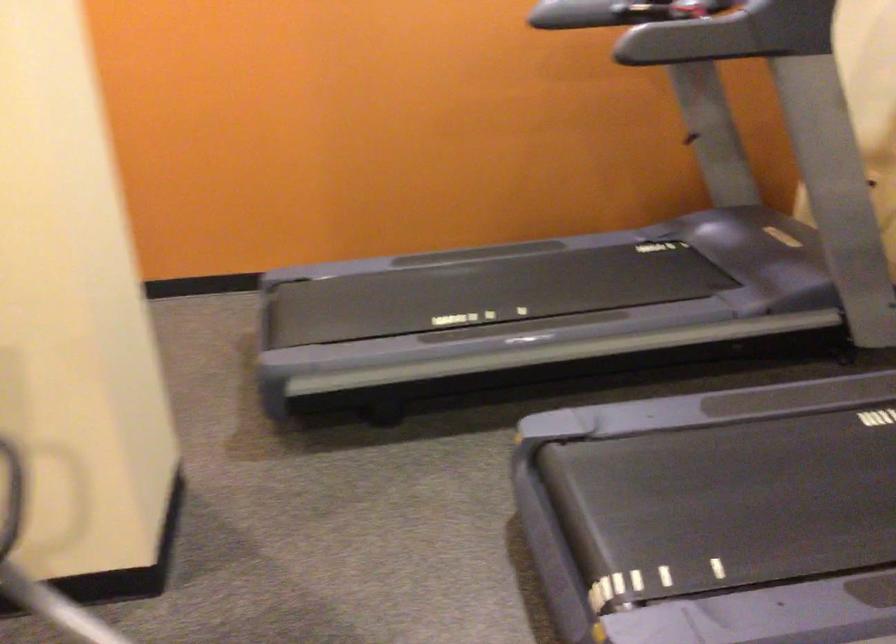
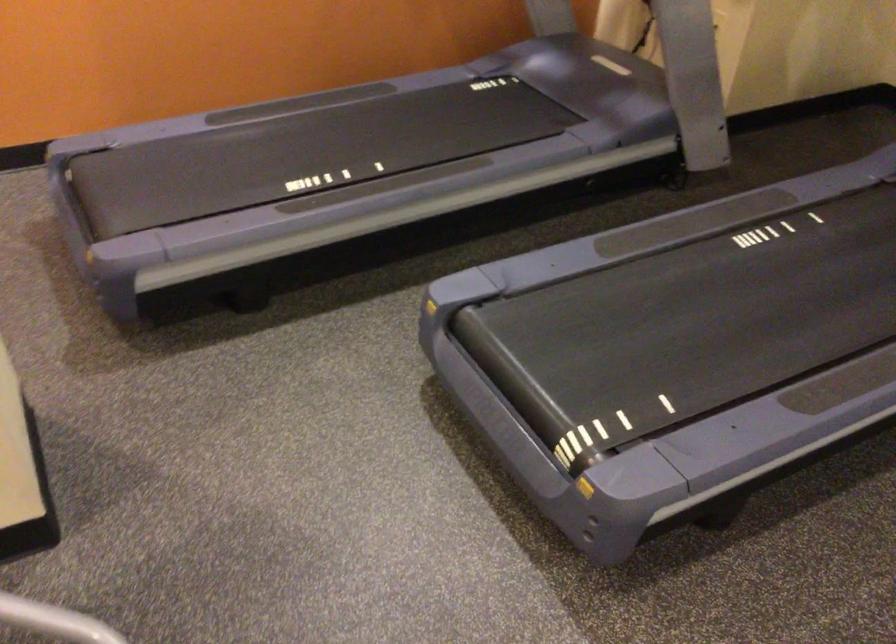
The point at [767,495] is marked in the first image. Where is the corresponding point in the second image?

(682, 324)